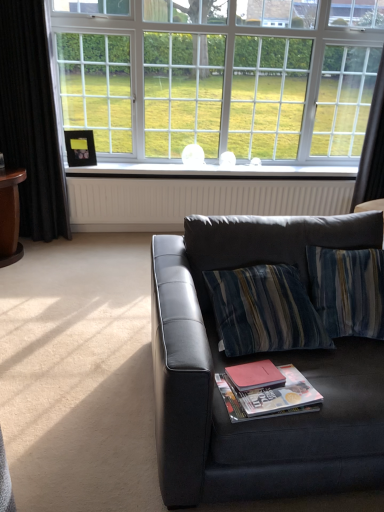
In order to click on free space in front of matte red paperback book at center in this screenshot , I will do `click(267, 402)`.